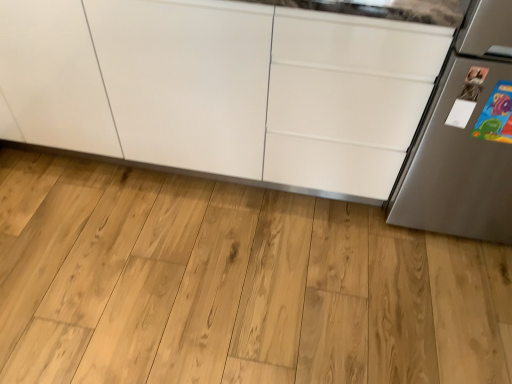
The width and height of the screenshot is (512, 384). What are the coordinates of `satin silver refrigerator at right` in the screenshot? It's located at (465, 137).

Where is `white glossy cabinet at center`? This screenshot has height=384, width=512. white glossy cabinet at center is located at coordinates (223, 87).

In order to click on refrigerator that appears in front of the natural wood flooring at center in this screenshot , I will do `click(465, 137)`.

Is natural wood flooring at center to the right of satin silver refrigerator at right from the viewer's perspective?

No.

From the image's perspective, between natural wood flooring at center and satin silver refrigerator at right, who is located below?

natural wood flooring at center.

From a real-world perspective, is natural wood flooring at center on top of satin silver refrigerator at right?

No, from a real-world perspective, natural wood flooring at center is not over satin silver refrigerator at right

Considering the positions of objects satin silver refrigerator at right and white glossy cabinet at center in the image provided, who is behind, satin silver refrigerator at right or white glossy cabinet at center?

white glossy cabinet at center is more distant.

From a real-world perspective, who is located higher, satin silver refrigerator at right or white glossy cabinet at center?

satin silver refrigerator at right.

From their relative heights in the image, would you say satin silver refrigerator at right is taller or shorter than white glossy cabinet at center?

satin silver refrigerator at right is taller than white glossy cabinet at center.

Can you confirm if satin silver refrigerator at right is bigger than white glossy cabinet at center?

No.

Which of these two, satin silver refrigerator at right or natural wood flooring at center, is bigger?

satin silver refrigerator at right.

You are a GUI agent. You are given a task and a screenshot of the screen. Output one action in this format:
    pyautogui.click(x=<x>, y=<y>)
    Task: Click on the hardwood behind the satin silver refrigerator at right
    The height and width of the screenshot is (384, 512).
    Given the screenshot: What is the action you would take?
    pyautogui.click(x=233, y=285)

In the image, is satin silver refrigerator at right on the left side or the right side of natural wood flooring at center?

satin silver refrigerator at right is to the right of natural wood flooring at center.

Is satin silver refrigerator at right positioned before natural wood flooring at center?

Yes, satin silver refrigerator at right is closer to the viewer.

Looking at their sizes, would you say natural wood flooring at center is wider or thinner than white glossy cabinet at center?

natural wood flooring at center is wider than white glossy cabinet at center.

Is point (281, 250) closer to camera compared to point (306, 162)?

No, (281, 250) is further to viewer.

Considering the sizes of objects natural wood flooring at center and white glossy cabinet at center in the image provided, who is bigger, natural wood flooring at center or white glossy cabinet at center?

With larger size is white glossy cabinet at center.

The height and width of the screenshot is (384, 512). I want to click on cabinetry on the left of the natural wood flooring at center, so pyautogui.click(x=223, y=87).

Is white glossy cabinet at center not within natural wood flooring at center?

Yes.

Is point (247, 167) closer to camera compared to point (444, 332)?

No, it is behind (444, 332).

Between white glossy cabinet at center and natural wood flooring at center, which one is positioned behind?

natural wood flooring at center is behind.

Does white glossy cabinet at center have a greater width compared to satin silver refrigerator at right?

Indeed, white glossy cabinet at center has a greater width compared to satin silver refrigerator at right.

From their relative heights in the image, would you say white glossy cabinet at center is taller or shorter than satin silver refrigerator at right?

white glossy cabinet at center is shorter than satin silver refrigerator at right.

Is white glossy cabinet at center situated inside satin silver refrigerator at right or outside?

The correct answer is: outside.

From the image's perspective, is white glossy cabinet at center on satin silver refrigerator at right?

Indeed, from the image's perspective, white glossy cabinet at center is shown above satin silver refrigerator at right.

You are a GUI agent. You are given a task and a screenshot of the screen. Output one action in this format:
    pyautogui.click(x=<x>, y=<y>)
    Task: Click on the refrigerator that is in front of the natural wood flooring at center
    The width and height of the screenshot is (512, 384).
    Given the screenshot: What is the action you would take?
    pyautogui.click(x=465, y=137)

I want to click on refrigerator below the white glossy cabinet at center (from the image's perspective), so click(x=465, y=137).

Considering their positions, is natural wood flooring at center positioned closer to white glossy cabinet at center than satin silver refrigerator at right?

natural wood flooring at center is closer to white glossy cabinet at center.

From the image, which object appears to be farther from satin silver refrigerator at right, white glossy cabinet at center or natural wood flooring at center?

The object further to satin silver refrigerator at right is natural wood flooring at center.

From the image, which object appears to be nearer to natural wood flooring at center, white glossy cabinet at center or satin silver refrigerator at right?

white glossy cabinet at center is positioned closer to the anchor natural wood flooring at center.

Which object lies further to the anchor point satin silver refrigerator at right, natural wood flooring at center or white glossy cabinet at center?

Among the two, natural wood flooring at center is located further to satin silver refrigerator at right.

Which object lies further to the anchor point natural wood flooring at center, satin silver refrigerator at right or white glossy cabinet at center?

Based on the image, satin silver refrigerator at right appears to be further to natural wood flooring at center.

Based on the photo, based on their spatial positions, is satin silver refrigerator at right or natural wood flooring at center closer to white glossy cabinet at center?

The object closer to white glossy cabinet at center is natural wood flooring at center.

At what (x,y) coordinates should I click in order to perform the action: click on hardwood between white glossy cabinet at center and satin silver refrigerator at right. Please return your answer as a coordinate pair (x, y). Looking at the image, I should click on (233, 285).